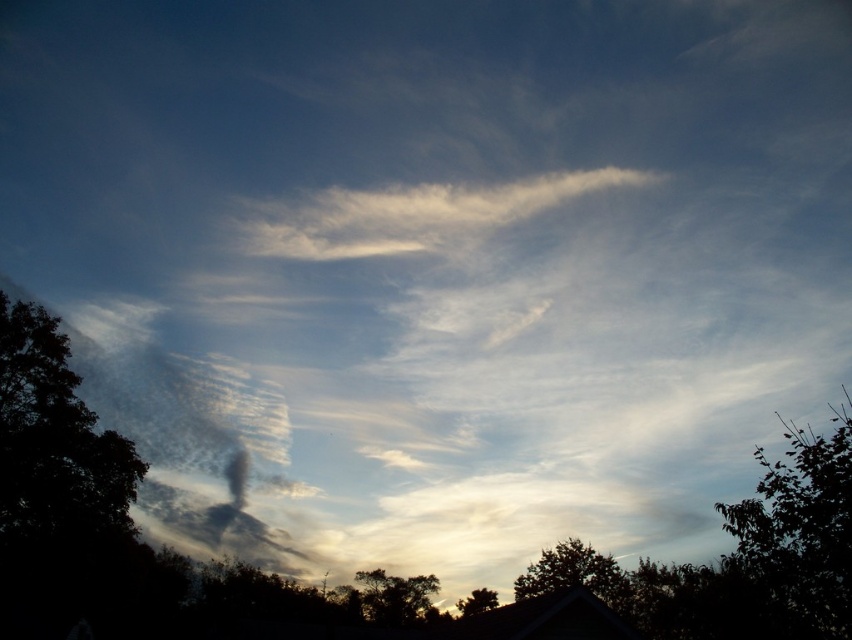
Is dark green leafy tree at left bigger than white cotton cloud at upper center?

No, dark green leafy tree at left is not bigger than white cotton cloud at upper center.

The image size is (852, 640). Describe the element at coordinates (56, 486) in the screenshot. I see `dark green leafy tree at left` at that location.

Locate an element on the screen. This screenshot has height=640, width=852. dark green leafy tree at left is located at coordinates (56, 486).

Locate an element on the screen. This screenshot has width=852, height=640. dark green leafy tree at left is located at coordinates (56, 486).

Between silvery gray foliage at right and white cotton cloud at upper center, which one has less height?

white cotton cloud at upper center is shorter.

Is point (810, 602) positioned behind point (419, 237)?

No.

The width and height of the screenshot is (852, 640). I want to click on silvery gray foliage at right, so click(x=801, y=529).

The width and height of the screenshot is (852, 640). Identify the location of silvery gray foliage at right. (801, 529).

Is dark green leafy tree at left thinner than silvery gray tree at lower center?

Correct, dark green leafy tree at left's width is less than silvery gray tree at lower center's.

Does dark green leafy tree at left have a greater width compared to silvery gray tree at lower center?

No, dark green leafy tree at left is not wider than silvery gray tree at lower center.

At what (x,y) coordinates should I click in order to perform the action: click on dark green leafy tree at left. Please return your answer as a coordinate pair (x, y). This screenshot has height=640, width=852. Looking at the image, I should click on (56, 486).

I want to click on dark green leafy tree at left, so click(56, 486).